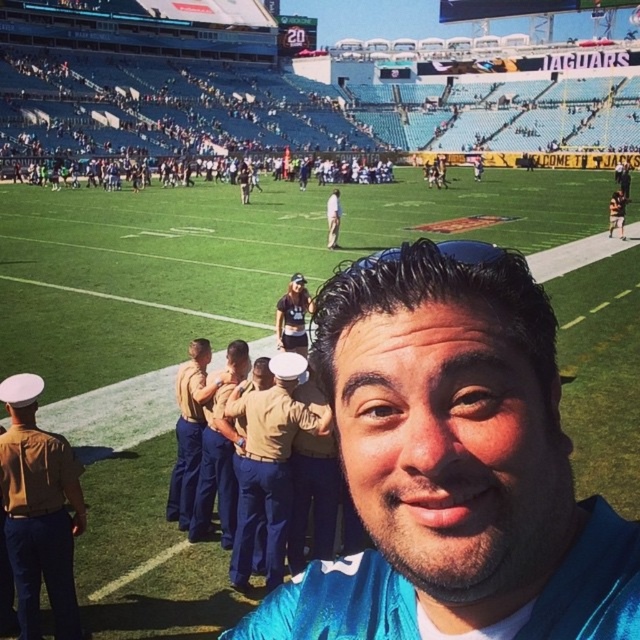
Question: Among these points, which one is farthest from the camera?

Choices:
 (A) (294, 333)
 (B) (70, 502)
 (C) (209, 346)
 (D) (268, 474)

Answer: (A)

Question: Is matte black uniform at center to the left of khaki uniform pants at center from the viewer's perspective?

Choices:
 (A) yes
 (B) no

Answer: (A)

Question: Is khaki uniform at left closer to the viewer compared to khaki uniform at center?

Choices:
 (A) no
 (B) yes

Answer: (B)

Question: Among these objects, which one is farthest from the camera?

Choices:
 (A) khaki uniform at left
 (B) uniformed navy blue pants at center
 (C) matte black uniform at center

Answer: (C)

Question: Does uniformed navy blue pants at center have a smaller size compared to matte black uniform at center?

Choices:
 (A) no
 (B) yes

Answer: (A)

Question: Which object is closer to the camera taking this photo?

Choices:
 (A) blue fabric shirt at center
 (B) khaki uniform pants at center
 (C) uniformed navy blue pants at center

Answer: (A)